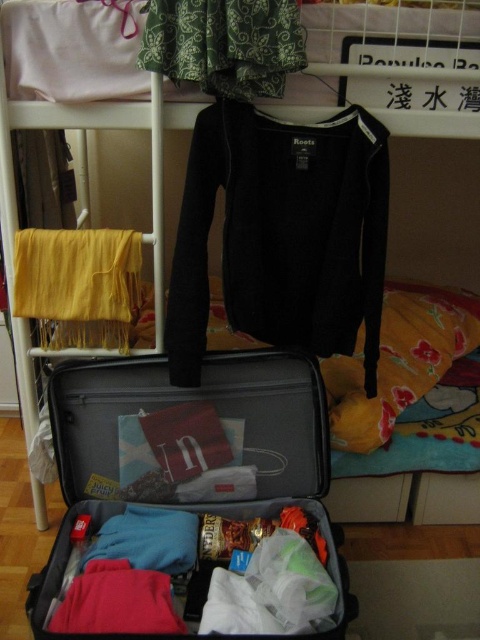
Is point (201, 68) farther from viewer compared to point (52, 234)?

That is False.

Can you confirm if patterned fabric pants at upper center is positioned to the left of yellow fabric at left?

No, patterned fabric pants at upper center is not to the left of yellow fabric at left.

Locate an element on the screen. The width and height of the screenshot is (480, 640). patterned fabric pants at upper center is located at coordinates (225, 44).

Locate an element on the screen. This screenshot has height=640, width=480. patterned fabric pants at upper center is located at coordinates (225, 44).

This screenshot has height=640, width=480. Describe the element at coordinates (283, 234) in the screenshot. I see `black jersey at center` at that location.

Consider the image. Which is above, black jersey at center or patterned fabric pants at upper center?

patterned fabric pants at upper center is above.

Where is `black jersey at center`? The height and width of the screenshot is (640, 480). black jersey at center is located at coordinates (283, 234).

Is the position of black jersey at center more distant than that of yellow fabric at left?

No, it is not.

Which is more to the left, black jersey at center or yellow fabric at left?

Positioned to the left is yellow fabric at left.

The width and height of the screenshot is (480, 640). What are the coordinates of `black jersey at center` in the screenshot? It's located at (283, 234).